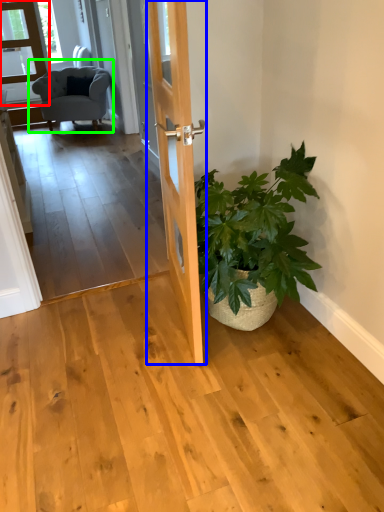
Question: Considering the real-world distances, which object is farthest from glass door (highlighted by a red box)? door (highlighted by a blue box) or chair (highlighted by a green box)?

Choices:
 (A) door
 (B) chair

Answer: (A)